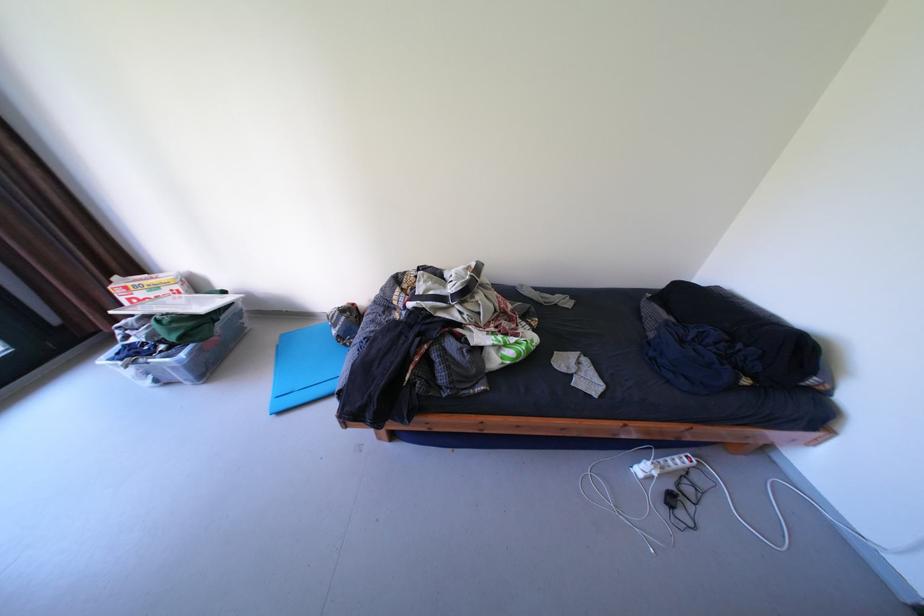
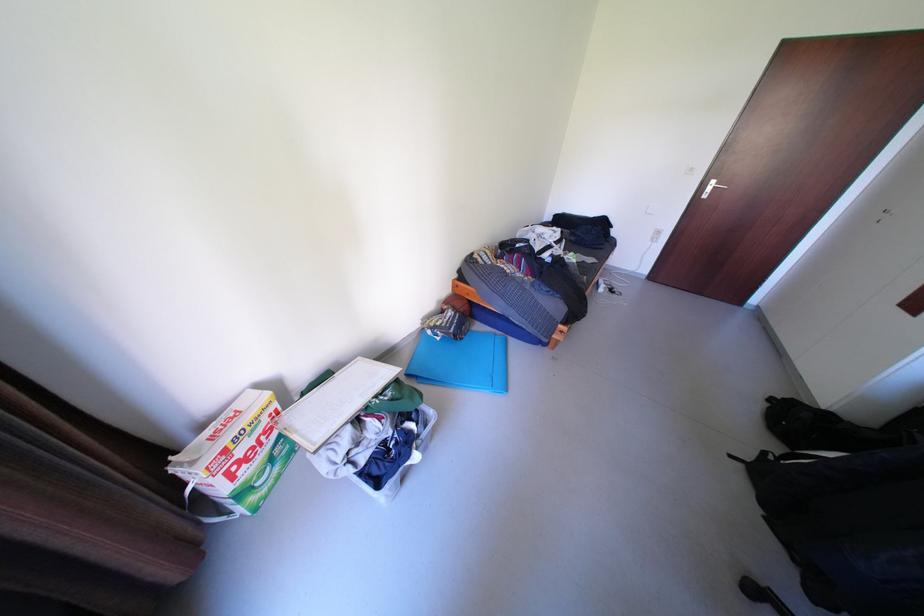
The point at (144, 341) is marked in the first image. Where is the corresponding point in the second image?

(372, 459)